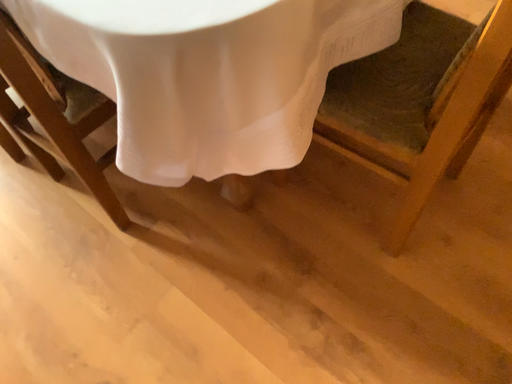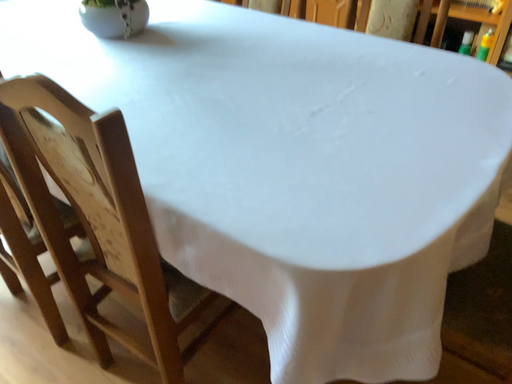
Question: How did the camera likely rotate when shooting the video?

Choices:
 (A) rotated upward
 (B) rotated downward

Answer: (A)